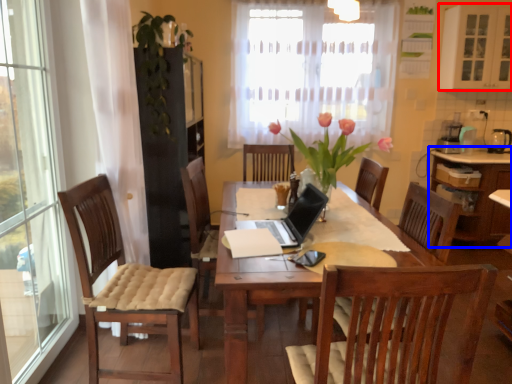
Question: Among these objects, which one is farthest to the camera, cabinetry (highlighted by a red box) or cabinetry (highlighted by a blue box)?

Choices:
 (A) cabinetry
 (B) cabinetry

Answer: (B)